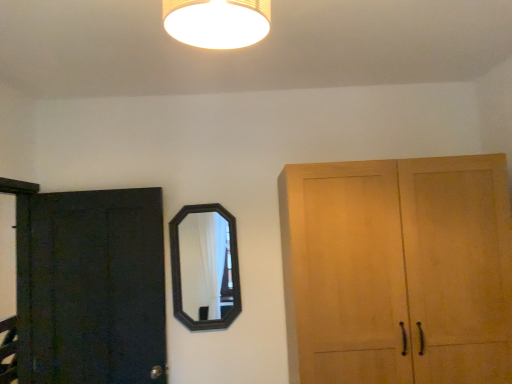
Question: Is black wooden mirror at center touching dark matte wood door at left?

Choices:
 (A) no
 (B) yes

Answer: (A)

Question: From a real-world perspective, is black wooden mirror at center located higher than dark matte wood door at left?

Choices:
 (A) yes
 (B) no

Answer: (A)

Question: Would you consider black wooden mirror at center to be distant from dark matte wood door at left?

Choices:
 (A) no
 (B) yes

Answer: (A)

Question: Can you confirm if black wooden mirror at center is wider than dark matte wood door at left?

Choices:
 (A) no
 (B) yes

Answer: (A)

Question: Is black wooden mirror at center bigger than dark matte wood door at left?

Choices:
 (A) no
 (B) yes

Answer: (A)

Question: Based on their positions, is matte yellow lampshade at upper center located to the left or right of black wooden mirror at center?

Choices:
 (A) right
 (B) left

Answer: (A)

Question: From the image's perspective, is matte yellow lampshade at upper center positioned above or below black wooden mirror at center?

Choices:
 (A) below
 (B) above

Answer: (B)

Question: From a real-world perspective, is matte yellow lampshade at upper center physically located above or below black wooden mirror at center?

Choices:
 (A) below
 (B) above

Answer: (B)

Question: Choose the correct answer: Is matte yellow lampshade at upper center inside black wooden mirror at center or outside it?

Choices:
 (A) outside
 (B) inside

Answer: (A)

Question: From the image's perspective, is black wooden mirror at center located above or below dark matte wood door at left?

Choices:
 (A) above
 (B) below

Answer: (A)

Question: From a real-world perspective, is black wooden mirror at center positioned above or below dark matte wood door at left?

Choices:
 (A) above
 (B) below

Answer: (A)

Question: In terms of width, does black wooden mirror at center look wider or thinner when compared to dark matte wood door at left?

Choices:
 (A) wide
 (B) thin

Answer: (B)

Question: Is black wooden mirror at center inside or outside of dark matte wood door at left?

Choices:
 (A) inside
 (B) outside

Answer: (B)

Question: Would you say matte yellow lampshade at upper center is to the left or to the right of dark matte wood door at left in the picture?

Choices:
 (A) left
 (B) right

Answer: (B)

Question: Based on their sizes in the image, would you say matte yellow lampshade at upper center is bigger or smaller than dark matte wood door at left?

Choices:
 (A) big
 (B) small

Answer: (B)